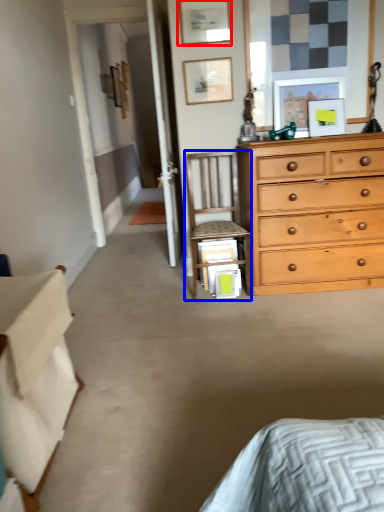
Question: Which object appears farthest to the camera in this image, picture frame (highlighted by a red box) or chair (highlighted by a blue box)?

Choices:
 (A) picture frame
 (B) chair

Answer: (A)